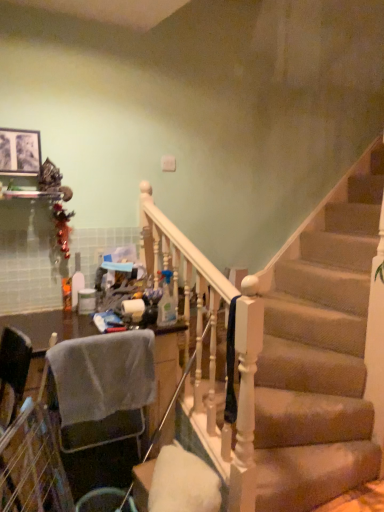
Question: Does point 94,501 appear closer or farther from the camera than point 167,272?

Choices:
 (A) closer
 (B) farther

Answer: (A)

Question: In terms of height, does metallic silver trash bin/can at lower left look taller or shorter compared to translucent plastic spray bottle at center, which ranks as the 1th bottle in right-to-left order?

Choices:
 (A) tall
 (B) short

Answer: (B)

Question: Considering the real-world distances, which object is closest to the matte black picture frame at upper left?

Choices:
 (A) metallic silver trash bin/can at lower left
 (B) translucent plastic spray bottle at center, placed as the 2th bottle when sorted from left to right
 (C) translucent plastic bottle at center, acting as the first bottle starting from the left

Answer: (C)

Question: Which object is the farthest from the metallic silver trash bin/can at lower left?

Choices:
 (A) matte black picture frame at upper left
 (B) translucent plastic spray bottle at center, placed as the 2th bottle when sorted from left to right
 (C) translucent plastic bottle at center, positioned as the 2th bottle in right-to-left order

Answer: (A)